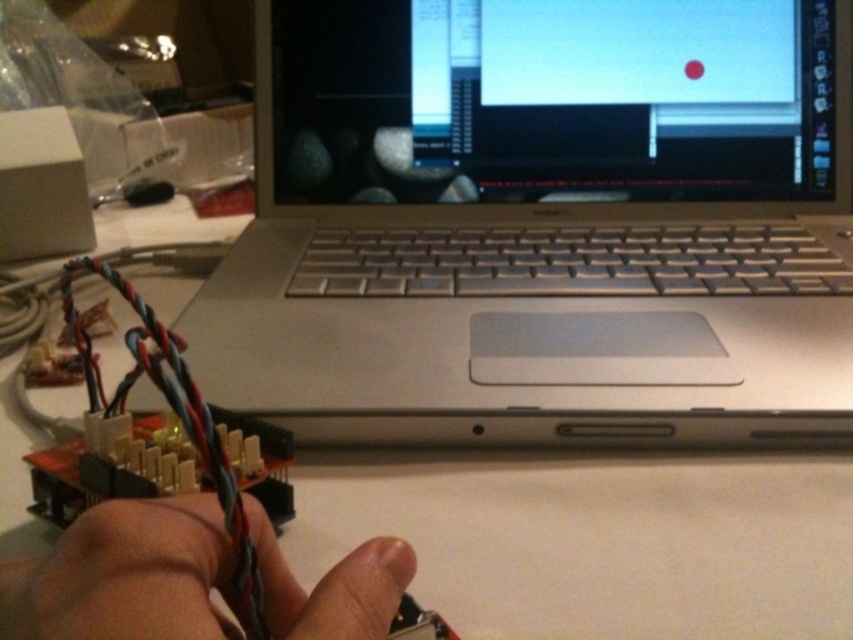
You are setting up an electronic project and need to place the silver metallic laptop at center and the skinny wire at lower left on a shelf. If the shelf has a height limit of 10 cm, can both items fit vertically without exceeding the height limit?

The silver metallic laptop at center is taller than the skinny wire at lower left. Since the shelf has a height limit of 10 cm, we need to know the exact height of the laptop. However, the description only states that the laptop is taller than the wire but does not provide specific measurements. Without knowing the exact height of the laptop, it is impossible to determine if both items will fit within the 10 cm limit.

You are working on a circuit board and need to adjust a connection between two points labeled as point (428, 438) and point (146, 579). Which point is closer to your hand holding the soldering iron if you are looking directly at the circuit board?

Point (146, 579) is closer to your hand because it is closer to the viewer than point (428, 438), which is further away.

You are setting up a new electronic project and need to place both the silver metallic laptop at center and the skinny wire at lower left on a small table. Given their sizes, which object will require more space on the table?

The silver metallic laptop at center is bigger than the skinny wire at lower left, so it will require more space on the table.